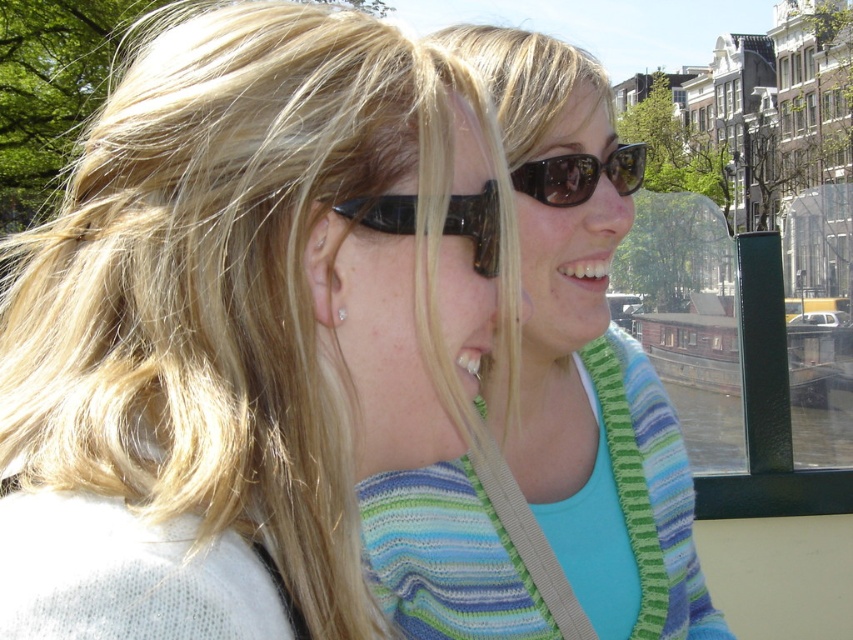
You are a photographer trying to capture the striped sweater at center and the matte silver earring at center in the same frame. Which object should you adjust your camera to focus on first if you want to include both in your shot?

The matte silver earring at center should be focused on first since the striped sweater at center is to the right of it, allowing you to adjust the camera to include both by moving rightward from the earring.

You are a photographer trying to capture a candid shot of the white glossy teeth at center without including the black matte sunglasses at upper center in the frame. Given their relative sizes, is it possible to do so?

The black matte sunglasses at upper center are wider than the white glossy teeth at center. Since the sunglasses are larger, it might be challenging to frame the shot to exclude them while focusing on the teeth unless adjusting the camera angle or zoom.

You are an interior designer assessing the spatial arrangement of the scene. You notice the striped sweater at center and the matte silver earring at center. Which object occupies more vertical space in the image?

The striped sweater at center has a greater height compared to the matte silver earring at center, so it occupies more vertical space.